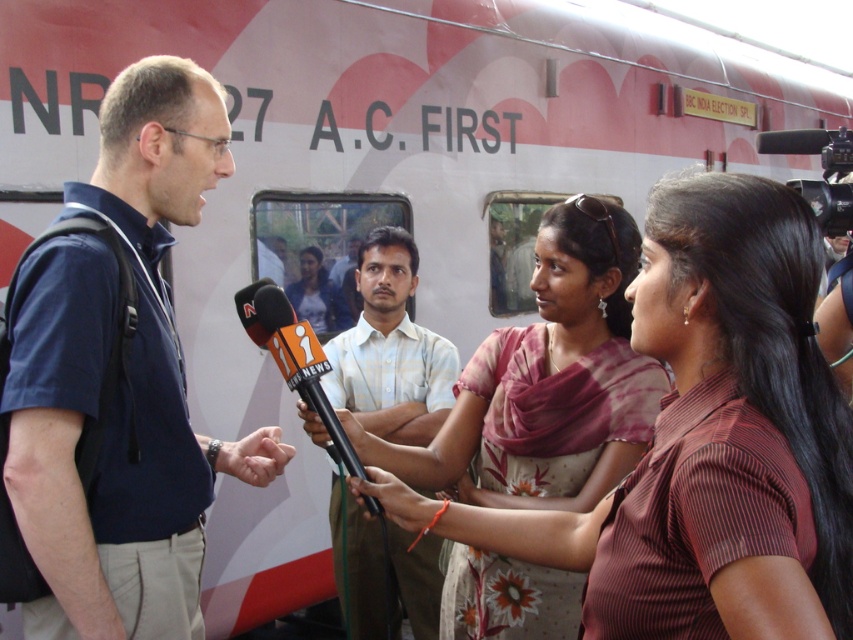
Is light blue shirt at center bigger than black plastic microphone at center?

Correct, light blue shirt at center is larger in size than black plastic microphone at center.

Does point (358, 291) lie behind point (331, 417)?

Yes.

Find the location of a particular element. light blue shirt at center is located at coordinates (390, 349).

Find the location of a particular element. light pink fabric saree at center is located at coordinates (706, 442).

Find the location of a particular element. The image size is (853, 640). light pink fabric saree at center is located at coordinates (706, 442).

Between light pink fabric saree at center and black plastic microphone at center, which one appears on the right side from the viewer's perspective?

Positioned to the right is light pink fabric saree at center.

Can you confirm if light pink fabric saree at center is shorter than black plastic microphone at center?

No.

Find the location of a particular element. light pink fabric saree at center is located at coordinates point(706,442).